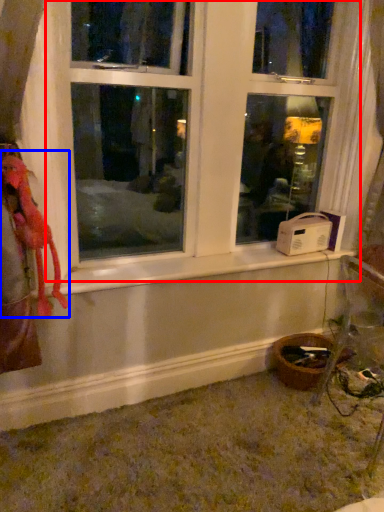
Question: Among these objects, which one is farthest to the camera, window (highlighted by a red box) or animal (highlighted by a blue box)?

Choices:
 (A) window
 (B) animal

Answer: (B)